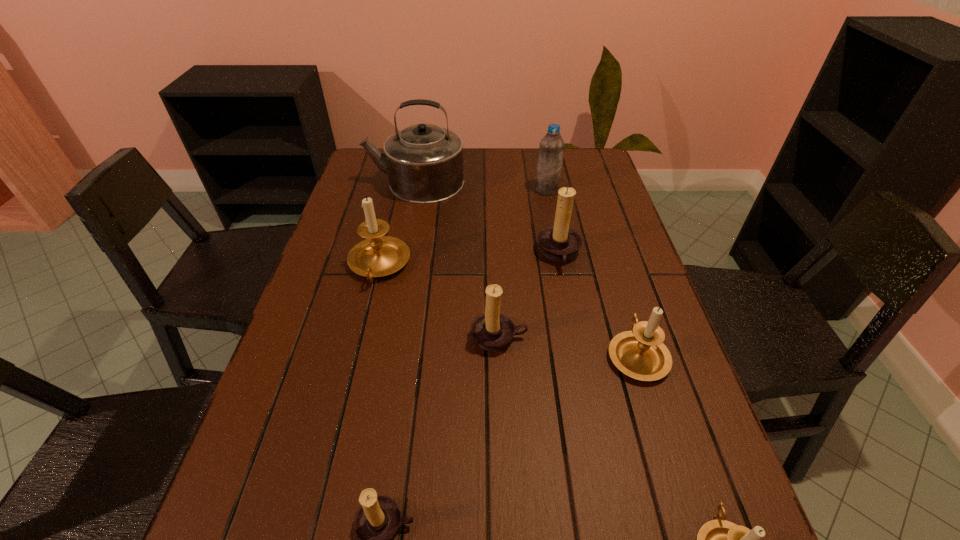
Identify the location of vacant position located 0.360m on the front of the blue water bottle. The width and height of the screenshot is (960, 540). (564, 272).

Image resolution: width=960 pixels, height=540 pixels. I want to click on vacant space situated 0.090m on the wick of the rightmost brown candle holder, so click(504, 254).

Find the location of a particular element. This screenshot has height=540, width=960. free location located 0.130m on the wick of the rightmost brown candle holder is located at coordinates (490, 254).

You are a GUI agent. You are given a task and a screenshot of the screen. Output one action in this format:
    pyautogui.click(x=<x>, y=<y>)
    Task: Click on the free space located 0.080m on the wick of the rightmost brown candle holder
    The width and height of the screenshot is (960, 540).
    Given the screenshot: What is the action you would take?
    pyautogui.click(x=508, y=254)

Locate an element on the screen. vacant region located 0.290m with a handle on the side of the farthest beige candle holder is located at coordinates (348, 392).

Identify the location of vacant area situated 0.300m with a handle on the side of the second biggest beige candle holder. (603, 245).

Locate an element on the screen. vacant space situated 0.290m with a handle on the side of the second biggest beige candle holder is located at coordinates (604, 247).

Locate an element on the screen. Image resolution: width=960 pixels, height=540 pixels. vacant space located with a handle on the side of the second biggest beige candle holder is located at coordinates (600, 237).

In order to click on vacant space situated 0.120m on the wick of the second brown candle holder from right to left in this screenshot , I will do pyautogui.click(x=501, y=404).

I want to click on kettle at the far edge, so click(424, 162).